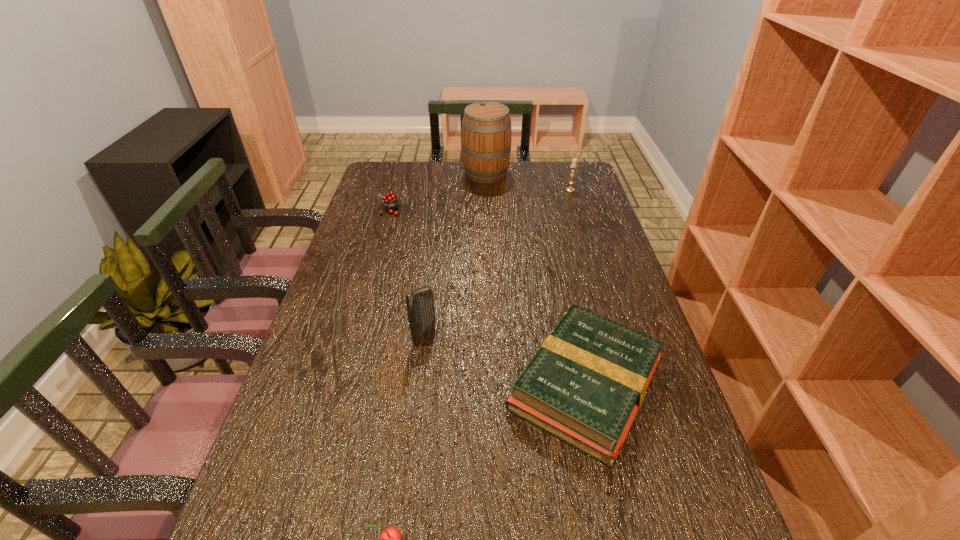
Locate an element on the screen. This screenshot has height=540, width=960. free location located on the front of the second farthest object is located at coordinates (581, 224).

I want to click on vacant space situated on the left of the hardback book, so click(x=357, y=386).

Find the location of a particular element. Image resolution: width=960 pixels, height=540 pixels. cider that is at the far edge is located at coordinates (486, 126).

This screenshot has width=960, height=540. In order to click on candle holder that is at the far edge in this screenshot , I will do `click(573, 165)`.

Where is `object that is at the left edge`? The height and width of the screenshot is (540, 960). object that is at the left edge is located at coordinates (390, 202).

I want to click on candle holder present at the right edge, so tap(573, 165).

Where is `hardback book that is at the right edge`? This screenshot has width=960, height=540. hardback book that is at the right edge is located at coordinates (585, 385).

This screenshot has height=540, width=960. What are the coordinates of `object located in the far right corner section of the desktop` in the screenshot? It's located at (573, 165).

Image resolution: width=960 pixels, height=540 pixels. Find the location of `free space at the far edge`. free space at the far edge is located at coordinates (420, 171).

This screenshot has width=960, height=540. I want to click on free location at the left edge, so click(366, 250).